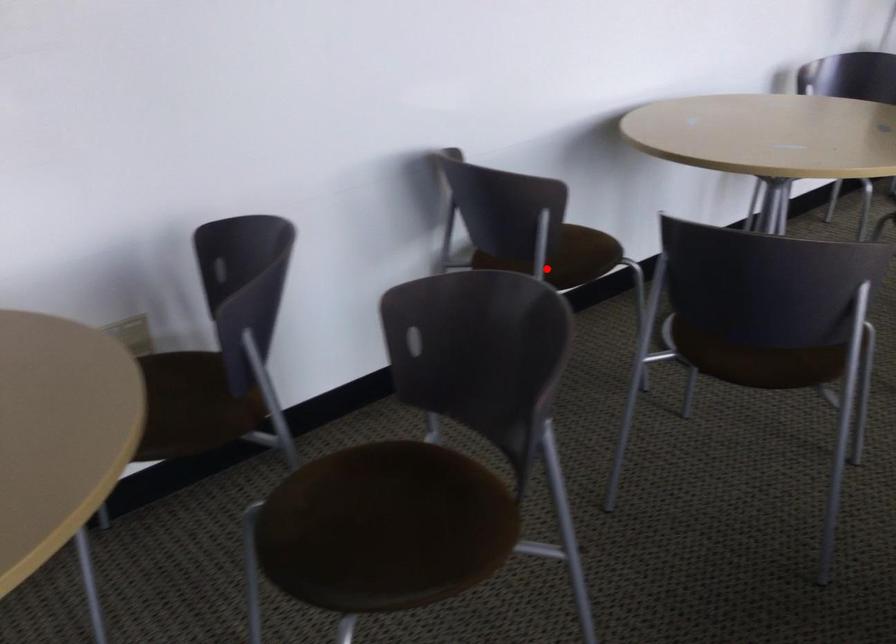
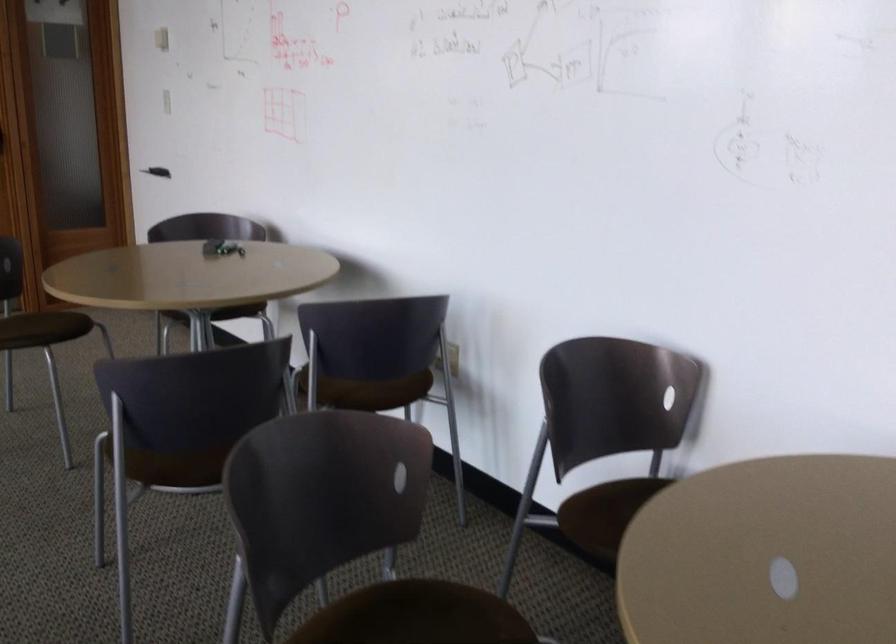
Question: I am providing you with two images of the same scene from different viewpoints. A red point is shown in image1. For the corresponding object point in image2, is it positioned nearer or farther from the camera?

Choices:
 (A) Nearer
 (B) Farther

Answer: (A)